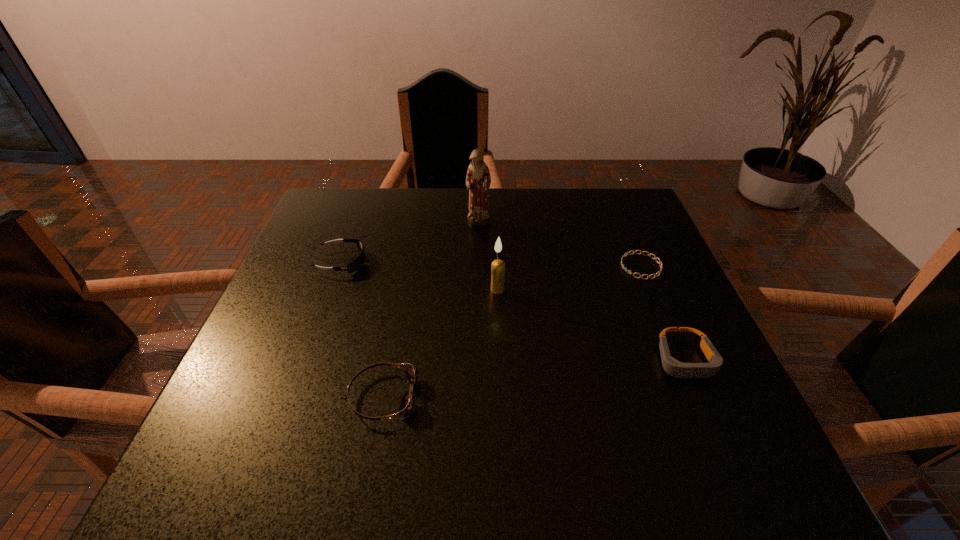
The image size is (960, 540). I want to click on bracelet at the right edge, so click(661, 265).

At what (x,y) coordinates should I click in order to perform the action: click on free spot at the far edge of the desktop. Please return your answer as a coordinate pair (x, y). The width and height of the screenshot is (960, 540). Looking at the image, I should click on (396, 210).

What are the coordinates of `vacant region at the near edge of the desktop` in the screenshot? It's located at (460, 482).

Where is `vacant space at the left edge`? Image resolution: width=960 pixels, height=540 pixels. vacant space at the left edge is located at coordinates (323, 362).

In the image, there is a desktop. At what (x,y) coordinates should I click in order to perform the action: click on vacant region at the right edge. Please return your answer as a coordinate pair (x, y). Looking at the image, I should click on (611, 255).

Locate an element on the screen. The image size is (960, 540). vacant space at the far left corner of the desktop is located at coordinates (338, 188).

Locate an element on the screen. Image resolution: width=960 pixels, height=540 pixels. free space at the far right corner of the desktop is located at coordinates (613, 234).

Where is `empty location between the bracelet and the leftmost object`? empty location between the bracelet and the leftmost object is located at coordinates (492, 264).

At what (x,y) coordinates should I click in order to perform the action: click on free spot between the tallest object and the second goggles from right to left. Please return your answer as a coordinate pair (x, y). Looking at the image, I should click on (431, 310).

Image resolution: width=960 pixels, height=540 pixels. In order to click on free space between the rightmost goggles and the candle in this screenshot , I will do `click(591, 325)`.